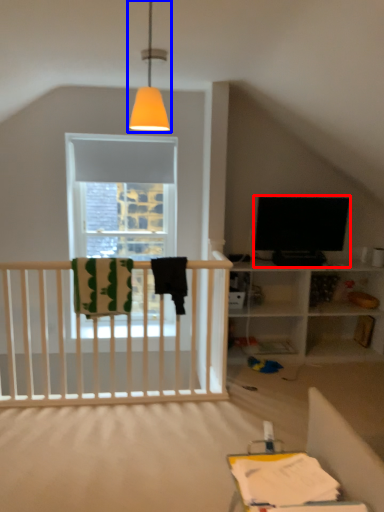
Question: Among these objects, which one is nearest to the camera, television (highlighted by a red box) or lamp (highlighted by a blue box)?

Choices:
 (A) television
 (B) lamp

Answer: (B)